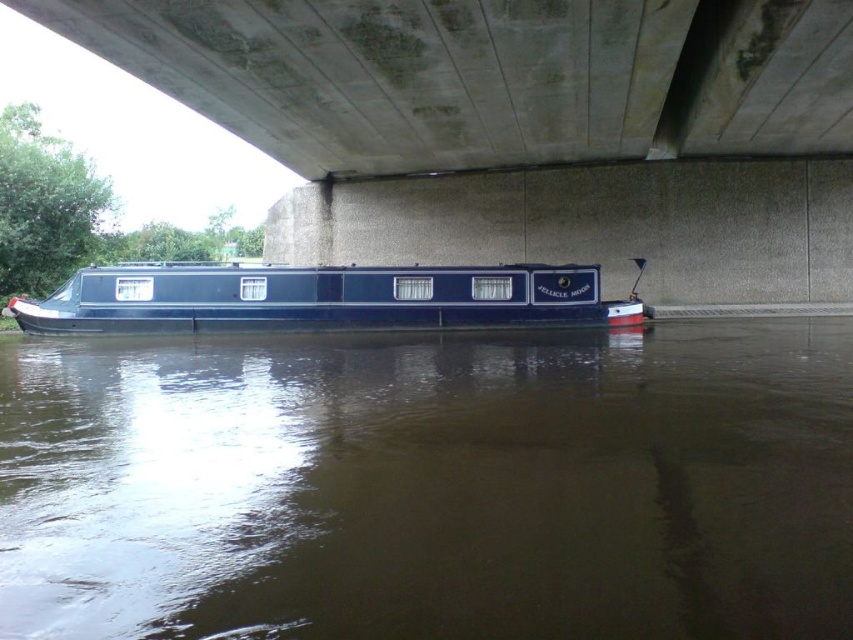
Question: Which object appears farthest from the camera in this image?

Choices:
 (A) shiny blue boat at center
 (B) concrete at upper center
 (C) brown murky water at center

Answer: (A)

Question: Observing the image, what is the correct spatial positioning of concrete at upper center in reference to shiny blue boat at center?

Choices:
 (A) left
 (B) right

Answer: (B)

Question: In this image, where is brown murky water at center located relative to concrete at upper center?

Choices:
 (A) above
 (B) below

Answer: (B)

Question: Which point appears closest to the camera in this image?

Choices:
 (A) (467, 300)
 (B) (767, 536)

Answer: (B)

Question: Which object is closer to the camera taking this photo?

Choices:
 (A) brown murky water at center
 (B) concrete at upper center

Answer: (A)

Question: Does concrete at upper center have a smaller size compared to shiny blue boat at center?

Choices:
 (A) yes
 (B) no

Answer: (A)